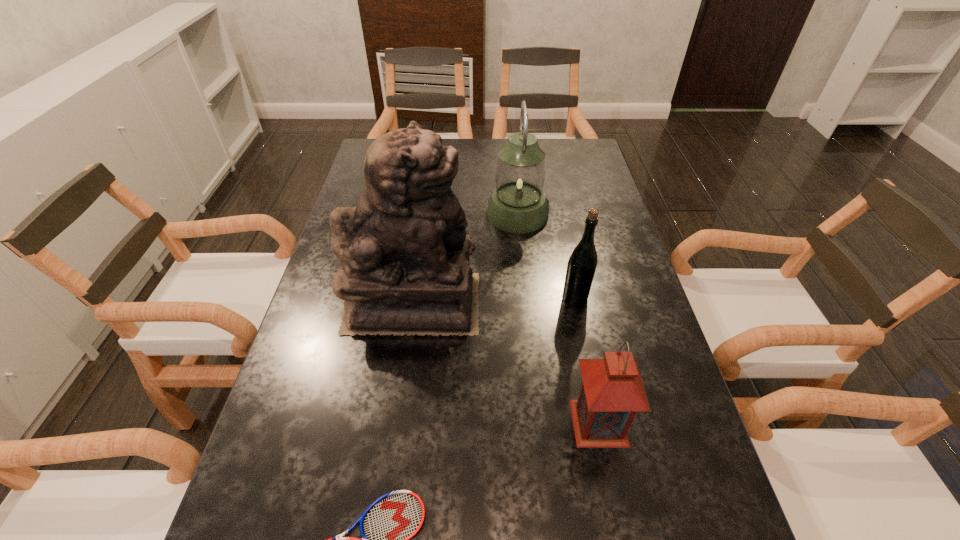
This screenshot has width=960, height=540. I want to click on the tallest object, so click(404, 254).

Locate an element on the screen. Image resolution: width=960 pixels, height=540 pixels. the second tallest object is located at coordinates (518, 204).

Locate an element on the screen. The image size is (960, 540). the farthest object is located at coordinates (518, 204).

At what (x,y) coordinates should I click in order to perform the action: click on beer bottle. Please return your answer as a coordinate pair (x, y). Looking at the image, I should click on (582, 263).

Where is `the nearer lantern`? Image resolution: width=960 pixels, height=540 pixels. the nearer lantern is located at coordinates (612, 392).

Locate an element on the screen. The height and width of the screenshot is (540, 960). the fourth farthest object is located at coordinates (612, 392).

Identify the location of blank space located 0.350m on the front-facing side of the sculpture. The height and width of the screenshot is (540, 960). (621, 302).

The width and height of the screenshot is (960, 540). I want to click on free space located 0.070m on the right of the farthest object, so click(x=571, y=214).

The width and height of the screenshot is (960, 540). What are the coordinates of `free space located 0.140m on the front of the beer bottle` in the screenshot? It's located at (587, 357).

The width and height of the screenshot is (960, 540). In order to click on free space located 0.080m on the back of the shorter lantern in this screenshot , I will do `click(588, 366)`.